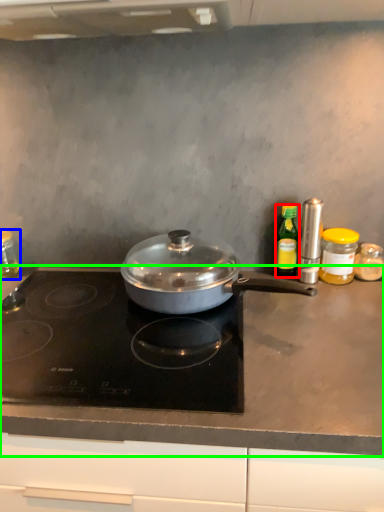
Question: Which is nearer to the kitchen appliance (highlighted by a red box)? kitchen appliance (highlighted by a blue box) or countertop (highlighted by a green box).

Choices:
 (A) kitchen appliance
 (B) countertop

Answer: (B)